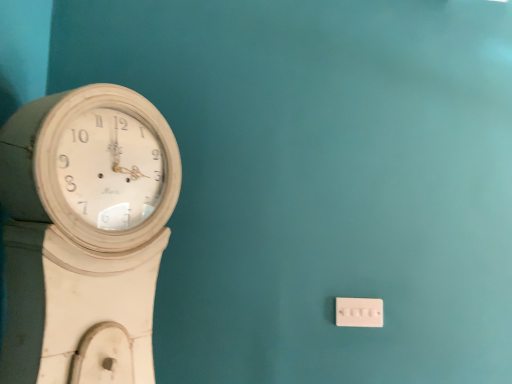
Question: Does white wooden wall clock at left have a lesser height compared to white plastic switch at lower right?

Choices:
 (A) yes
 (B) no

Answer: (B)

Question: Is the depth of white wooden wall clock at left greater than that of white plastic switch at lower right?

Choices:
 (A) no
 (B) yes

Answer: (A)

Question: Does white wooden wall clock at left appear on the left side of white plastic switch at lower right?

Choices:
 (A) yes
 (B) no

Answer: (A)

Question: From a real-world perspective, is white wooden wall clock at left positioned over white plastic switch at lower right based on gravity?

Choices:
 (A) no
 (B) yes

Answer: (B)

Question: Is white wooden wall clock at left oriented towards white plastic switch at lower right?

Choices:
 (A) no
 (B) yes

Answer: (B)

Question: Considering the relative sizes of white wooden wall clock at left and white plastic switch at lower right in the image provided, is white wooden wall clock at left smaller than white plastic switch at lower right?

Choices:
 (A) no
 (B) yes

Answer: (A)

Question: Is white plastic switch at lower right behind white wooden wall clock at left?

Choices:
 (A) yes
 (B) no

Answer: (A)

Question: From the image's perspective, is white plastic switch at lower right beneath white wooden wall clock at left?

Choices:
 (A) no
 (B) yes

Answer: (B)

Question: Is white plastic switch at lower right to the right of white wooden wall clock at left from the viewer's perspective?

Choices:
 (A) yes
 (B) no

Answer: (A)

Question: Can you confirm if white plastic switch at lower right is smaller than white wooden wall clock at left?

Choices:
 (A) yes
 (B) no

Answer: (A)

Question: Does white plastic switch at lower right have a lesser height compared to white wooden wall clock at left?

Choices:
 (A) yes
 (B) no

Answer: (A)

Question: Is white plastic switch at lower right facing towards white wooden wall clock at left?

Choices:
 (A) no
 (B) yes

Answer: (A)

Question: Considering the positions of white plastic switch at lower right and white wooden wall clock at left in the image, is white plastic switch at lower right wider or thinner than white wooden wall clock at left?

Choices:
 (A) thin
 (B) wide

Answer: (A)